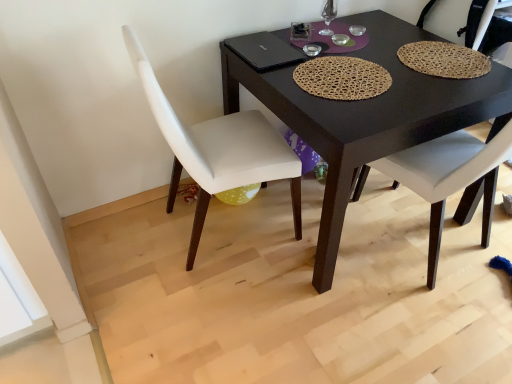
Question: Does point (275, 76) appear closer or farther from the camera than point (490, 16)?

Choices:
 (A) farther
 (B) closer

Answer: (B)

Question: In the image, is black matte table at center on the left side or the right side of white leather chair at center, which ranks as the second chair in left-to-right order?

Choices:
 (A) left
 (B) right

Answer: (A)

Question: Which is nearer to the white leather chair at center, which ranks as the second chair in left-to-right order?

Choices:
 (A) black matte table at center
 (B) white leather chair at lower left, the 2th chair when ordered from right to left

Answer: (A)

Question: Considering the real-world distances, which object is farthest from the white leather chair at center, the 1th chair from the right?

Choices:
 (A) white leather chair at lower left, the 1th chair positioned from the left
 (B) black matte table at center

Answer: (A)